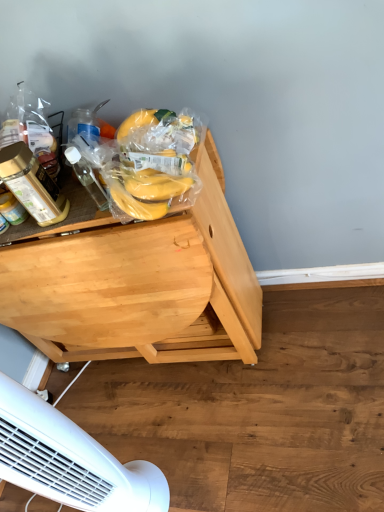
In order to click on vacant area in front of light wood desk at center in this screenshot , I will do `click(225, 426)`.